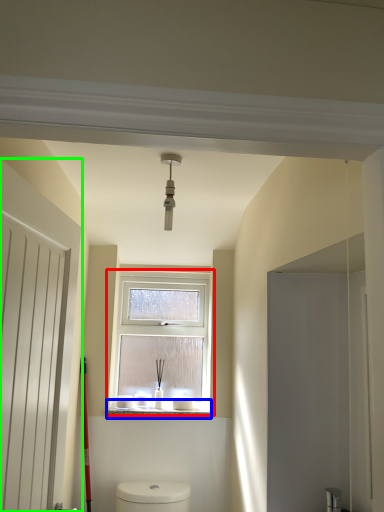
Question: Which is farther away from window (highlighted by a red box)? window sill (highlighted by a blue box) or door (highlighted by a green box)?

Choices:
 (A) window sill
 (B) door

Answer: (B)